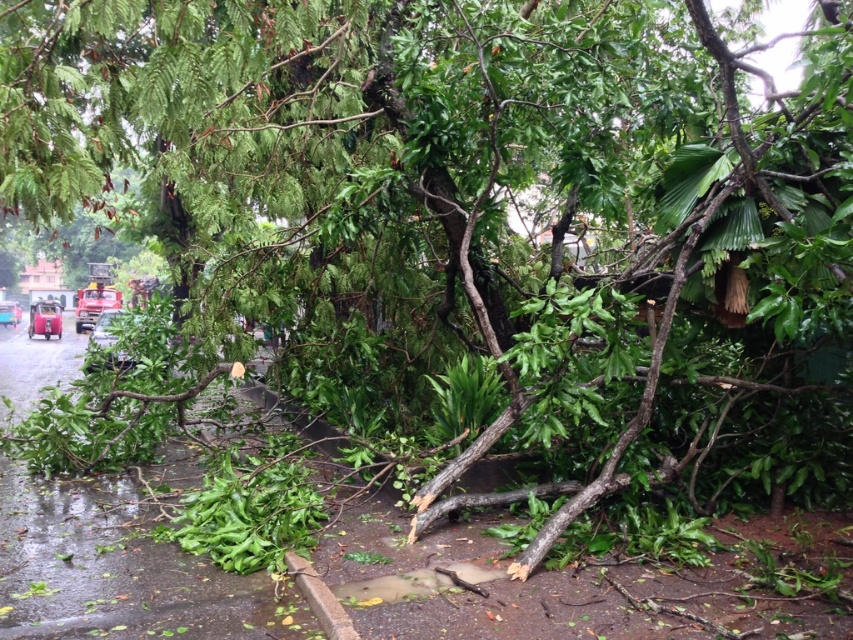
You are a tow truck operator and need to tow both the metallic red car at left and the metallic blue car at lower left. Which car should you tow first if you want to tow the bigger one first?

The metallic red car at left has a larger size compared to the metallic blue car at lower left, so you should tow the metallic red car at left first.

You are a delivery driver who needs to park your van between the metallic red car at left and the metallic blue car at lower left. The van is 6 meters long. Can you fit the van between them without overlapping either car?

The metallic red car at left is 8.20 meters away from the metallic blue car at lower left. Since the van is 6 meters long, there is enough space between them to park without overlapping either car.

You are a delivery driver who needs to park your metallic red car at left in a safe spot away from the storm damage. Based on the scene, where should you move the car to avoid the uprooted tree and other hazards?

The metallic red car at left should be moved to a location away from the uprooted tree and other damaged areas. Since the car is currently at point (x=44, y=317), moving it to a safer area like a parking lot or a stable area away from the storm damage would be advisable.